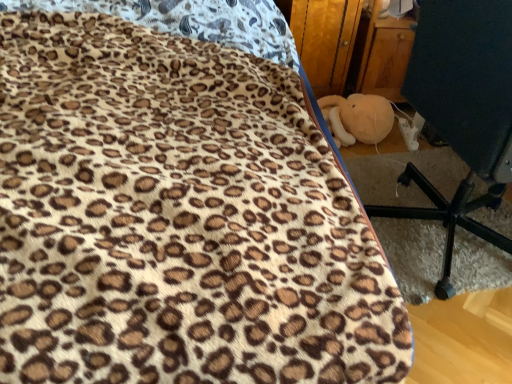
Question: In terms of size, does black plastic chair at lower right appear bigger or smaller than wooden at right?

Choices:
 (A) big
 (B) small

Answer: (A)

Question: From the image's perspective, relative to wooden at right, is black plastic chair at lower right above or below?

Choices:
 (A) below
 (B) above

Answer: (A)

Question: Estimate the real-world distances between objects in this image. Which object is closer to the wooden at right?

Choices:
 (A) soft plush toy at lower right
 (B) black plastic chair at lower right

Answer: (A)

Question: Which is nearer to the soft plush toy at lower right?

Choices:
 (A) wooden at right
 (B) black plastic chair at lower right

Answer: (A)